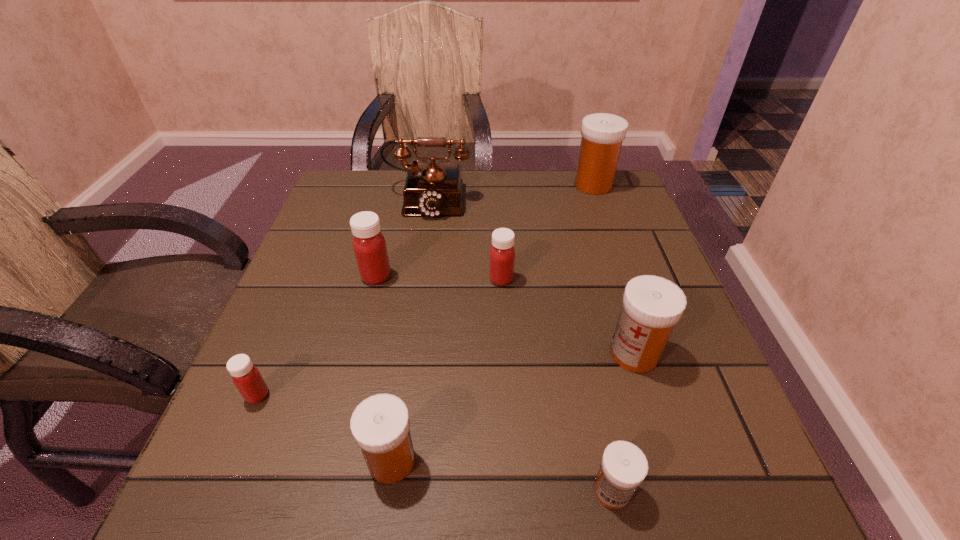
I want to click on free location located 0.190m on the right of the leftmost white medicine, so click(545, 461).

Identify the location of free location located 0.190m on the right of the sixth farthest object. [383, 395].

This screenshot has width=960, height=540. I want to click on vacant space located on the left of the fifth medicine from left to right, so click(400, 491).

The width and height of the screenshot is (960, 540). Find the location of `medicine present at the far edge`. medicine present at the far edge is located at coordinates (602, 134).

What are the coordinates of `telephone positioned at the far edge` in the screenshot? It's located at (432, 189).

Locate an element on the screen. The height and width of the screenshot is (540, 960). telephone that is at the left edge is located at coordinates (432, 189).

Identify the location of object that is at the far left corner. Image resolution: width=960 pixels, height=540 pixels. (432, 189).

I want to click on object at the far right corner, so click(602, 134).

This screenshot has height=540, width=960. Find the location of `free location at the far edge`. free location at the far edge is located at coordinates 540,202.

Locate an element on the screen. free space at the near edge is located at coordinates (355, 519).